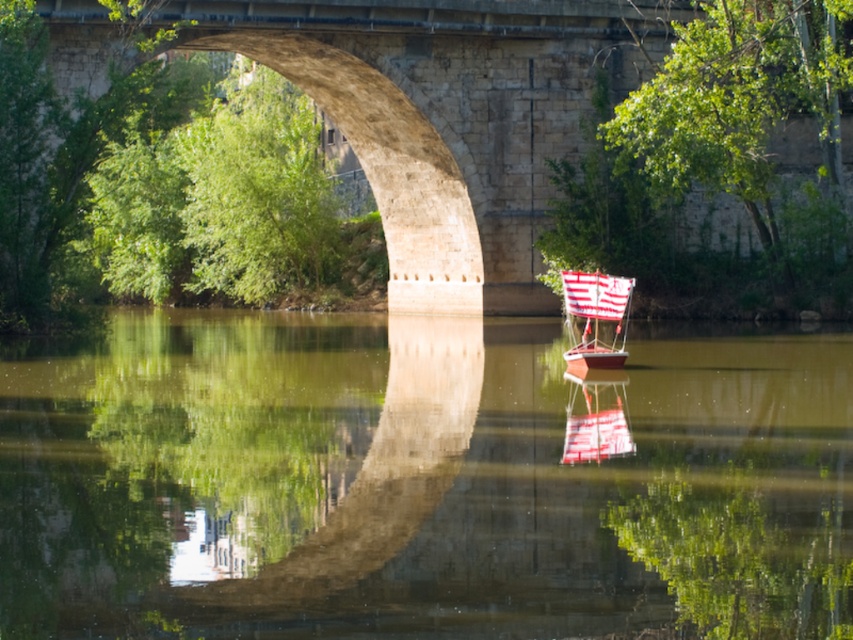
Question: Can you confirm if green reflective water at center is smaller than white fabric sailboat at center?

Choices:
 (A) no
 (B) yes

Answer: (A)

Question: Based on their relative distances, which object is nearer to the stone bridge at center?

Choices:
 (A) white fabric sailboat at center
 (B) green reflective water at center

Answer: (A)

Question: Based on their relative distances, which object is farther from the white fabric sailboat at center?

Choices:
 (A) stone bridge at center
 (B) green reflective water at center

Answer: (A)

Question: Can you confirm if green reflective water at center is positioned to the left of white fabric sailboat at center?

Choices:
 (A) no
 (B) yes

Answer: (B)

Question: From the image, what is the correct spatial relationship of green reflective water at center in relation to stone bridge at center?

Choices:
 (A) left
 (B) right

Answer: (B)

Question: Which object is farther from the camera taking this photo?

Choices:
 (A) stone bridge at center
 (B) white fabric sailboat at center

Answer: (A)